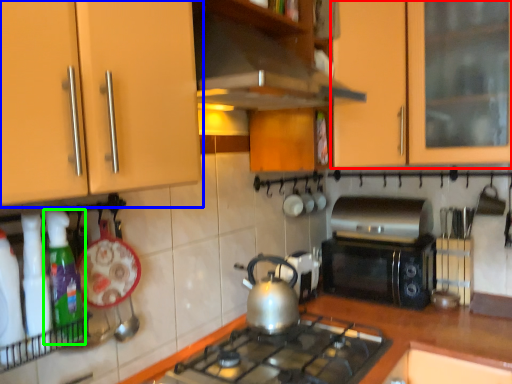
Question: Estimate the real-world distances between objects in this image. Which object is closer to cabinetry (highlighted by a red box), cabinetry (highlighted by a blue box) or kitchen appliance (highlighted by a green box)?

Choices:
 (A) cabinetry
 (B) kitchen appliance

Answer: (A)